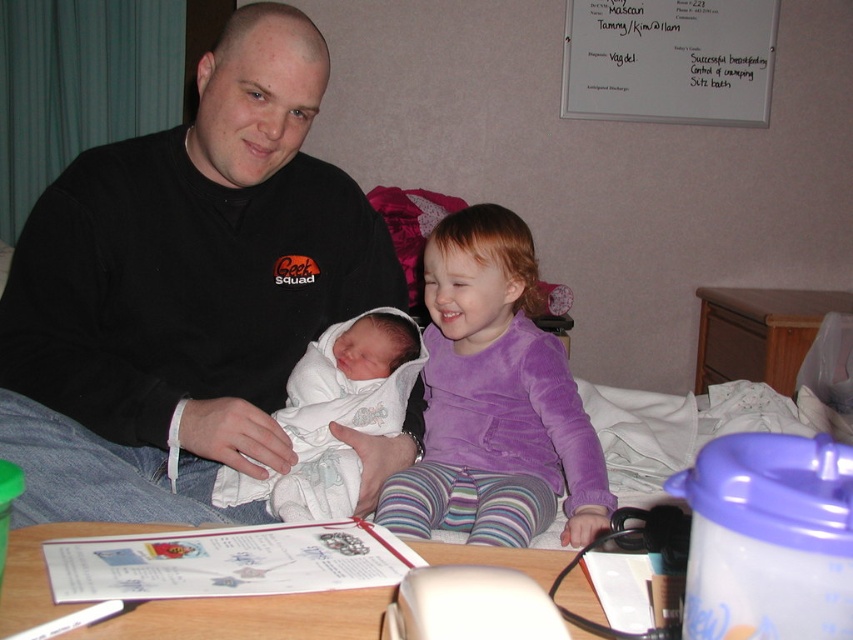
Who is more forward, (432, 483) or (518, 548)?

Point (518, 548) is in front.

Who is shorter, purple velvety shirt at center or white plastic table at lower center?

white plastic table at lower center

Locate an element on the screen. purple velvety shirt at center is located at coordinates (494, 401).

Can you confirm if purple velvety shirt at center is thinner than white clothed baby at center?

Incorrect, purple velvety shirt at center's width is not less than white clothed baby at center's.

Where is `purple velvety shirt at center`? Image resolution: width=853 pixels, height=640 pixels. purple velvety shirt at center is located at coordinates (494, 401).

In order to click on purple velvety shirt at center in this screenshot , I will do `click(494, 401)`.

Does white plastic table at lower center have a smaller size compared to white clothed baby at center?

Correct, white plastic table at lower center occupies less space than white clothed baby at center.

Who is higher up, white plastic table at lower center or white clothed baby at center?

white clothed baby at center is higher up.

Between point (25, 561) and point (276, 513), which one is positioned behind?

Point (276, 513)

The image size is (853, 640). What are the coordinates of `white plastic table at lower center` in the screenshot? It's located at (251, 618).